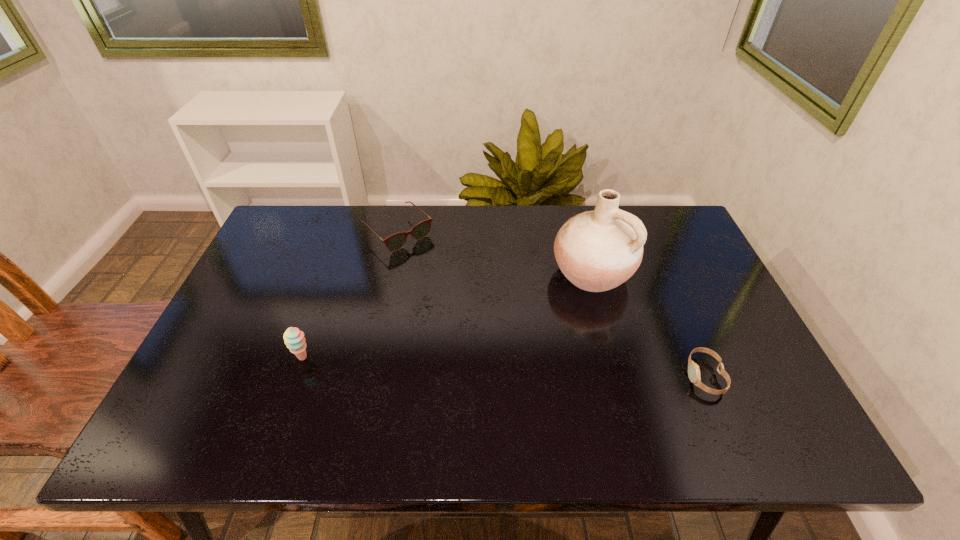
Locate an element on the screen. vacant area that lies between the spectacles and the second tallest object is located at coordinates point(350,295).

At what (x,y) coordinates should I click in order to perform the action: click on empty location between the second shortest object and the tallest object. Please return your answer as a coordinate pair (x, y). The height and width of the screenshot is (540, 960). Looking at the image, I should click on (495, 253).

Locate an element on the screen. vacant point located between the second tallest object and the watch is located at coordinates (504, 367).

Where is `vacant region between the watch and the tallest object`? The width and height of the screenshot is (960, 540). vacant region between the watch and the tallest object is located at coordinates [x=648, y=325].

This screenshot has height=540, width=960. Find the location of `vacant area between the third object from right to left and the pottery`. vacant area between the third object from right to left and the pottery is located at coordinates (495, 253).

Where is `free spot between the spectacles and the watch`? The width and height of the screenshot is (960, 540). free spot between the spectacles and the watch is located at coordinates (551, 305).

Locate an element on the screen. vacant region between the leftmost object and the tallest object is located at coordinates (447, 315).

Locate an element on the screen. empty location between the pottery and the leftmost object is located at coordinates (447, 315).

Identify the location of free spot between the spectacles and the watch. Image resolution: width=960 pixels, height=540 pixels. (551, 305).

You are a GUI agent. You are given a task and a screenshot of the screen. Output one action in this format:
    pyautogui.click(x=<x>, y=<y>)
    Task: Click on the third closest object to the shortest object
    The image size is (960, 540).
    Given the screenshot: What is the action you would take?
    pyautogui.click(x=294, y=339)